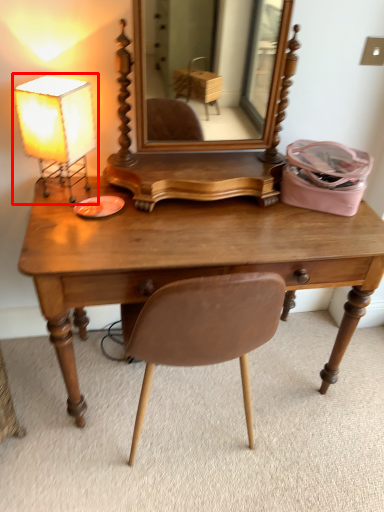
Question: From the image, what is the correct spatial relationship of lamp (annotated by the red box) in relation to desk?

Choices:
 (A) right
 (B) left

Answer: (B)